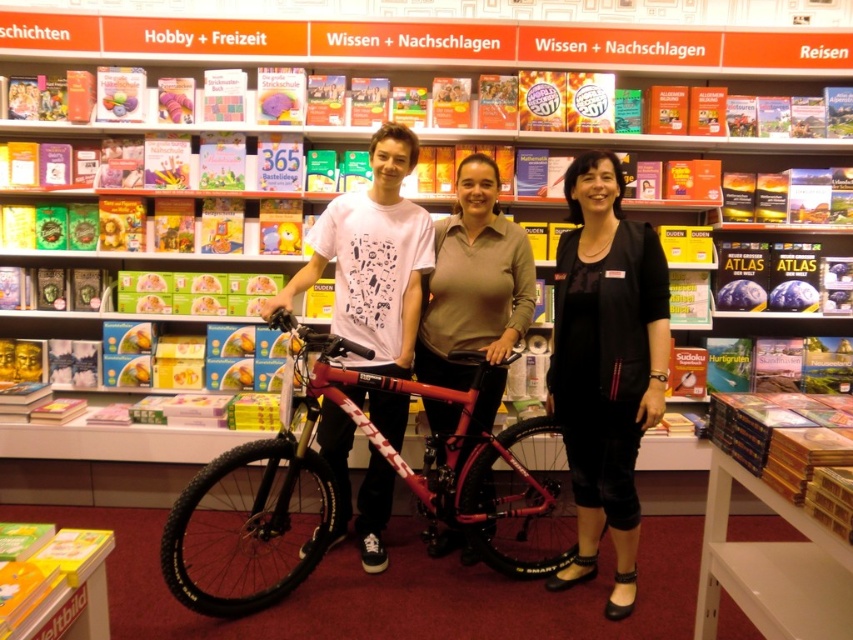
Is shiny metallic bicycle at center thinner than matte pink bicycle at center?

No.

Is shiny metallic bicycle at center further to camera compared to matte pink bicycle at center?

No, it is in front of matte pink bicycle at center.

I want to click on shiny metallic bicycle at center, so click(267, 493).

Identify the location of shiny metallic bicycle at center. (267, 493).

Who is shorter, matte black bicycle at center or matte white t-shirt at center?

Standing shorter between the two is matte black bicycle at center.

Between matte black bicycle at center and matte white t-shirt at center, which one appears on the right side from the viewer's perspective?

From the viewer's perspective, matte black bicycle at center appears more on the right side.

Where is `matte black bicycle at center`? matte black bicycle at center is located at coordinates (608, 356).

You are a GUI agent. You are given a task and a screenshot of the screen. Output one action in this format:
    pyautogui.click(x=<x>, y=<y>)
    Task: Click on the matte black bicycle at center
    
    Given the screenshot: What is the action you would take?
    pyautogui.click(x=608, y=356)

Is point (569, 301) farther from camera compared to point (590, 416)?

That is False.

Is point (488, 412) positioned after point (579, 252)?

Yes.

Locate an element on the screen. This screenshot has width=853, height=640. matte black bicycle at center is located at coordinates (608, 356).